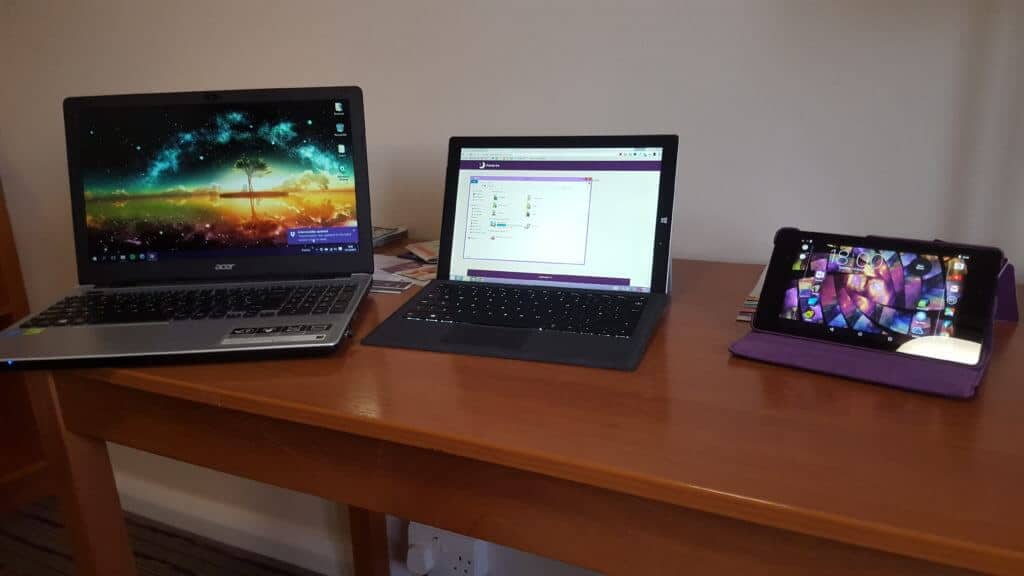
Identify the location of indicator light. This screenshot has width=1024, height=576. (9, 363).